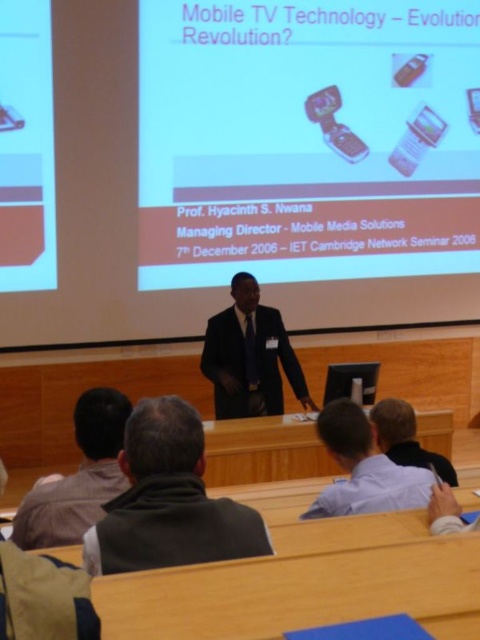
Does gray fleece vest at lower center have a lesser width compared to light blue shirt at center?

Yes, gray fleece vest at lower center is thinner than light blue shirt at center.

Is gray fleece vest at lower center shorter than light blue shirt at center?

Yes, gray fleece vest at lower center is shorter than light blue shirt at center.

Find the location of a particular element. gray fleece vest at lower center is located at coordinates click(x=168, y=500).

Locate an element on the screen. gray fleece vest at lower center is located at coordinates (168, 500).

Which of these two, white glossy projector screen at upper center or dark suit at center, stands taller?

Standing taller between the two is white glossy projector screen at upper center.

Is point (454, 224) closer to camera compared to point (276, 317)?

No, (454, 224) is further to viewer.

You are a GUI agent. You are given a task and a screenshot of the screen. Output one action in this format:
    pyautogui.click(x=<x>, y=<y>)
    Task: Click on the white glossy projector screen at upper center
    
    Given the screenshot: What is the action you would take?
    pyautogui.click(x=307, y=140)

Is striped shirt at lower left closer to the viewer compared to light blue shirt at center?

That is True.

Is point (120, 396) farther from camera compared to point (346, 401)?

No, it is not.

Describe the element at coordinates (78, 476) in the screenshot. I see `striped shirt at lower left` at that location.

At what (x,y) coordinates should I click in order to perform the action: click on striped shirt at lower left. Please return your answer as a coordinate pair (x, y). The height and width of the screenshot is (640, 480). Looking at the image, I should click on (78, 476).